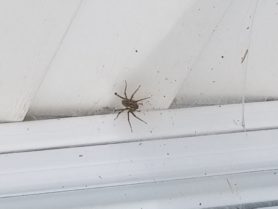
Find the location of `frame`. frame is located at coordinates (58, 171).